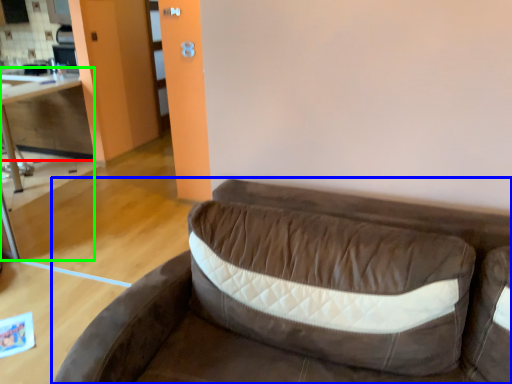
Question: Which object is the farthest from cabinetry (highlighted by a red box)? Choose among these: studio couch (highlighted by a blue box) or table (highlighted by a green box).

Choices:
 (A) studio couch
 (B) table

Answer: (A)